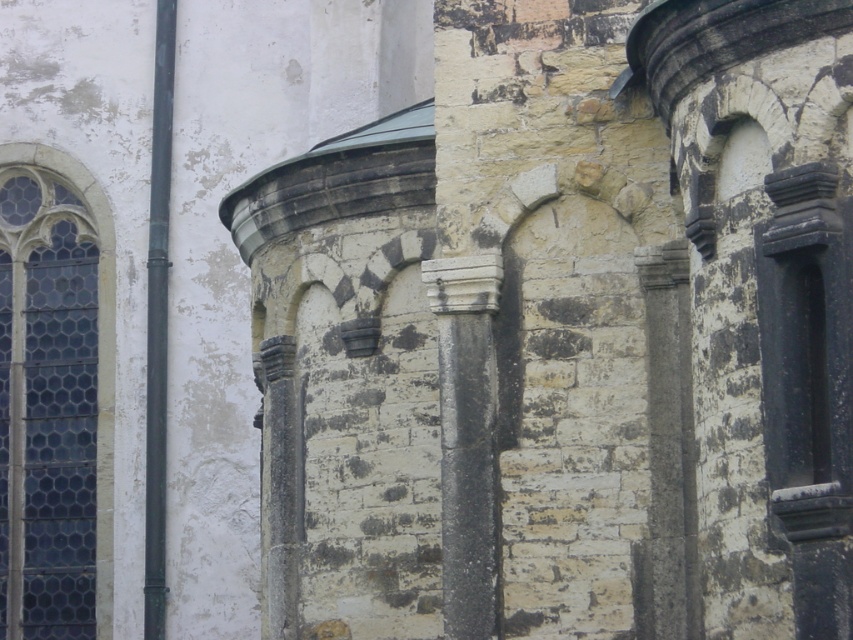
You are an architect examining this historical building. You notice the dark blue glass window at left and the white stone column at center. Which object is positioned lower in the structure?

The dark blue glass window at left is positioned below the white stone column at center, so it is lower in the structure.

You are an architect examining the structure. You need to install a new support beam that must be placed between the dark blue glass window at left and the white stone column at center. Based on their positions, which side of the column should the beam be placed?

The dark blue glass window at left is positioned on the left side of the white stone column at center, so the support beam should be placed to the left of the white stone column at center to align with the window.